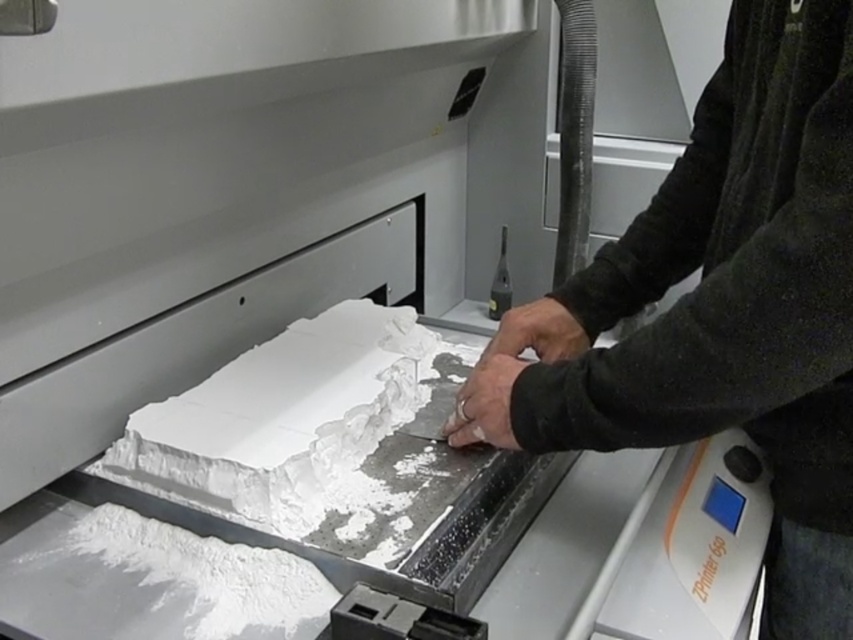
Question: Can you confirm if black matte hands at center is smaller than white matte cake at center?

Choices:
 (A) yes
 (B) no

Answer: (B)

Question: Does black matte hands at center have a lesser width compared to white matte cake at center?

Choices:
 (A) no
 (B) yes

Answer: (B)

Question: Which point appears closest to the camera in this image?

Choices:
 (A) (x=247, y=376)
 (B) (x=776, y=616)

Answer: (B)

Question: Is black matte hands at center to the left of white matte cake at center from the viewer's perspective?

Choices:
 (A) no
 (B) yes

Answer: (A)